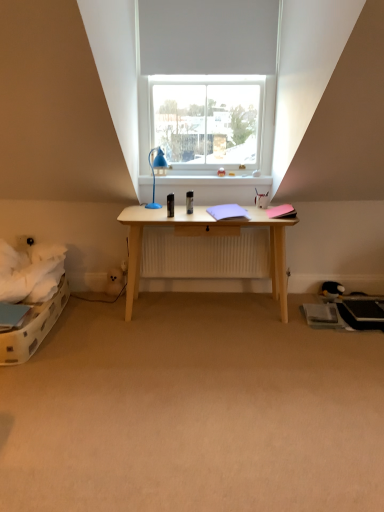
You are a GUI agent. You are given a task and a screenshot of the screen. Output one action in this format:
    pyautogui.click(x=<x>, y=<y>)
    Task: Click on the blue plastic lamp at center
    This screenshot has width=384, height=512.
    Given the screenshot: What is the action you would take?
    pyautogui.click(x=154, y=173)

What do you see at coordinates (332, 290) in the screenshot? I see `black plush toy at lower right` at bounding box center [332, 290].

This screenshot has height=512, width=384. I want to click on beige carpet at center, so click(x=194, y=410).

You are a GUI agent. You are given a task and a screenshot of the screen. Output one action in this format:
    pyautogui.click(x=<x>, y=<y>)
    Task: Click on the window sill located behind the white matte window at upper center
    
    Given the screenshot: What is the action you would take?
    click(x=215, y=183)

Is white glossy window sill at upper center not inside white matte window at upper center?

white glossy window sill at upper center lies outside white matte window at upper center's area.

Between white glossy window sill at upper center and white matte window at upper center, which one appears on the right side from the viewer's perspective?

Positioned to the right is white glossy window sill at upper center.

From a real-world perspective, is white glossy window sill at upper center positioned under white matte window at upper center based on gravity?

Indeed, from a real-world perspective, white glossy window sill at upper center is positioned beneath white matte window at upper center.

Locate an element on the screen. Image resolution: width=384 pixels, height=512 pixels. window sill on the left side of beige carpet at center is located at coordinates (215, 183).

Do you think beige carpet at center is within white glossy window sill at upper center, or outside of it?

beige carpet at center exists outside the volume of white glossy window sill at upper center.

Which is more to the right, beige carpet at center or white glossy window sill at upper center?

beige carpet at center is more to the right.

Considering the relative sizes of black plush toy at lower right and beige carpet at center in the image provided, is black plush toy at lower right thinner than beige carpet at center?

Yes.

From the image's perspective, would you say black plush toy at lower right is shown under beige carpet at center?

No, from the image's perspective, black plush toy at lower right is not below beige carpet at center.

Is black plush toy at lower right spatially inside beige carpet at center, or outside of it?

black plush toy at lower right exists outside the volume of beige carpet at center.

From a real-world perspective, which is physically above, black plush toy at lower right or beige carpet at center?

From a 3D spatial view, black plush toy at lower right is above.

Is white matte window at upper center situated inside beige carpet at center or outside?

white matte window at upper center exists outside the volume of beige carpet at center.

Considering the sizes of white matte window at upper center and beige carpet at center in the image, is white matte window at upper center bigger or smaller than beige carpet at center?

Clearly, white matte window at upper center is smaller in size than beige carpet at center.

Considering the positions of objects white matte window at upper center and beige carpet at center in the image provided, who is more to the left, white matte window at upper center or beige carpet at center?

Positioned to the left is white matte window at upper center.

Between point (160, 70) and point (44, 409), which one is positioned in front?

The point (44, 409) is closer.

Does blue plastic lamp at center have a greater height compared to black plush toy at lower right?

Indeed, blue plastic lamp at center has a greater height compared to black plush toy at lower right.

Consider the image. Is blue plastic lamp at center turned away from black plush toy at lower right?

No, black plush toy at lower right is not at the back of blue plastic lamp at center.

Considering the positions of objects blue plastic lamp at center and black plush toy at lower right in the image provided, who is more to the right, blue plastic lamp at center or black plush toy at lower right?

Positioned to the right is black plush toy at lower right.

From a real-world perspective, between blue plastic lamp at center and black plush toy at lower right, who is vertically lower?

In real-world perspective, black plush toy at lower right is lower.

From the image's perspective, which one is positioned higher, beige carpet at center or black plush toy at lower right?

black plush toy at lower right.

Between point (227, 496) and point (330, 288), which one is positioned behind?

Point (330, 288)

Identify the location of plain that is below the black plush toy at lower right (from the image's perspective). (194, 410).

Who is more distant, beige carpet at center or black plush toy at lower right?

black plush toy at lower right is more distant.

Can you confirm if beige carpet at center is positioned to the left of white matte window at upper center?

In fact, beige carpet at center is to the right of white matte window at upper center.

From a real-world perspective, is beige carpet at center positioned over white matte window at upper center based on gravity?

No, from a real-world perspective, beige carpet at center is not over white matte window at upper center

In terms of width, does beige carpet at center look wider or thinner when compared to white matte window at upper center?

In the image, beige carpet at center appears to be wider than white matte window at upper center.

From the picture: How different are the orientations of beige carpet at center and white matte window at upper center in degrees?

90.1 degrees.

At what (x,y) coordinates should I click in order to perform the action: click on window sill below the white matte window at upper center (from the image's perspective). Please return your answer as a coordinate pair (x, y). This screenshot has height=512, width=384. Looking at the image, I should click on click(x=215, y=183).

I want to click on plain below the white glossy window sill at upper center (from a real-world perspective), so click(194, 410).

Which object lies nearer to the anchor point beige carpet at center, white matte window at upper center or white glossy window sill at upper center?

white glossy window sill at upper center is closer to beige carpet at center.

From the image, which object appears to be farther from blue plastic lamp at center, white glossy window sill at upper center or black plush toy at lower right?

The object further to blue plastic lamp at center is black plush toy at lower right.

Based on their spatial positions, is blue plastic lamp at center or beige carpet at center further from black plush toy at lower right?

blue plastic lamp at center.

Estimate the real-world distances between objects in this image. Which object is closer to white glossy window sill at upper center, black plush toy at lower right or blue plastic lamp at center?

blue plastic lamp at center lies closer to white glossy window sill at upper center than the other object.

When comparing their distances from white glossy window sill at upper center, does black plush toy at lower right or beige carpet at center seem closer?

black plush toy at lower right is positioned closer to the anchor white glossy window sill at upper center.

From the image, which object appears to be nearer to beige carpet at center, white matte window at upper center or blue plastic lamp at center?

blue plastic lamp at center is closer to beige carpet at center.

Considering their positions, is beige carpet at center positioned closer to blue plastic lamp at center than white matte window at upper center?

white matte window at upper center is positioned closer to the anchor blue plastic lamp at center.

Considering their positions, is white matte window at upper center positioned further to black plush toy at lower right than white glossy window sill at upper center?

white matte window at upper center is further to black plush toy at lower right.

The height and width of the screenshot is (512, 384). In order to click on lamp positioned between beige carpet at center and black plush toy at lower right from near to far in this screenshot , I will do `click(154, 173)`.

Image resolution: width=384 pixels, height=512 pixels. In order to click on lamp positioned between beige carpet at center and white glossy window sill at upper center from near to far in this screenshot , I will do `click(154, 173)`.

In order to click on window sill between white matte window at upper center and beige carpet at center from top to bottom in this screenshot , I will do `click(215, 183)`.

Locate an element on the screen. This screenshot has height=512, width=384. lamp between white matte window at upper center and black plush toy at lower right in the up-down direction is located at coordinates (154, 173).